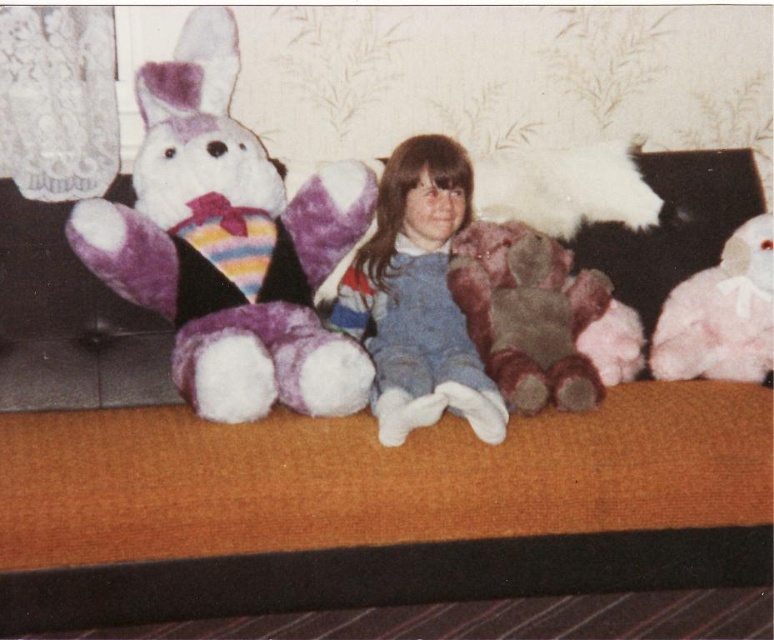
This screenshot has width=774, height=640. What do you see at coordinates (528, 314) in the screenshot?
I see `fuzzy brown teddy bear at center` at bounding box center [528, 314].

Is point (536, 337) positioned behind point (757, 349)?

No.

What do you see at coordinates (528, 314) in the screenshot? The width and height of the screenshot is (774, 640). I see `fuzzy brown teddy bear at center` at bounding box center [528, 314].

At what (x,y) coordinates should I click in order to perform the action: click on fuzzy brown teddy bear at center. Please return your answer as a coordinate pair (x, y). Looking at the image, I should click on (528, 314).

Which of these two, purple plush bunny at left or fluffy pink teddy bear at right, stands shorter?

Standing shorter between the two is fluffy pink teddy bear at right.

This screenshot has height=640, width=774. Describe the element at coordinates (228, 243) in the screenshot. I see `purple plush bunny at left` at that location.

Describe the element at coordinates (228, 243) in the screenshot. I see `purple plush bunny at left` at that location.

At what (x,y) coordinates should I click in order to perform the action: click on purple plush bunny at left. Please return your answer as a coordinate pair (x, y). The height and width of the screenshot is (640, 774). Looking at the image, I should click on (228, 243).

Is blue denim overalls at center above fuzzy brown teddy bear at center?

Correct, blue denim overalls at center is located above fuzzy brown teddy bear at center.

Who is positioned more to the right, blue denim overalls at center or fuzzy brown teddy bear at center?

fuzzy brown teddy bear at center is more to the right.

Between point (341, 301) and point (485, 314), which one is positioned in front?

Point (485, 314)

The image size is (774, 640). What are the coordinates of `blue denim overalls at center` in the screenshot? It's located at (418, 298).